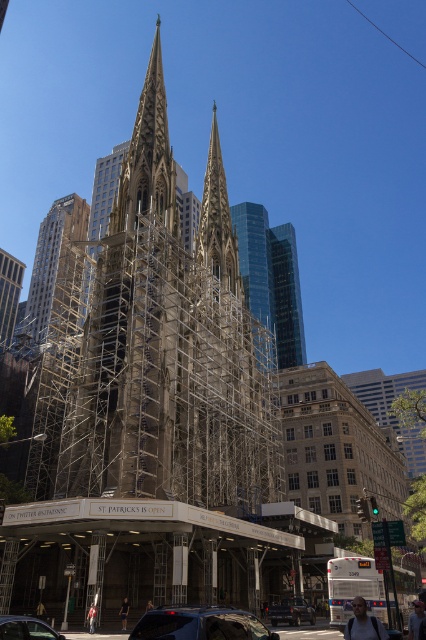
You are a pedestrian standing on the street near the cathedral. You see the gold metallic spire at upper left and the metallic silver car at lower center. Which object is positioned higher from the ground?

The gold metallic spire at upper left is located above the metallic silver car at lower center, so it is positioned higher from the ground.

You are a city planner assessing the cathedral renovation. The gold metallic spire at upper left and the black matte car at lower center are both visible from the street. Which object appears wider in the scene?

The gold metallic spire at upper left appears wider than the black matte car at lower center as its width is larger according to the description.